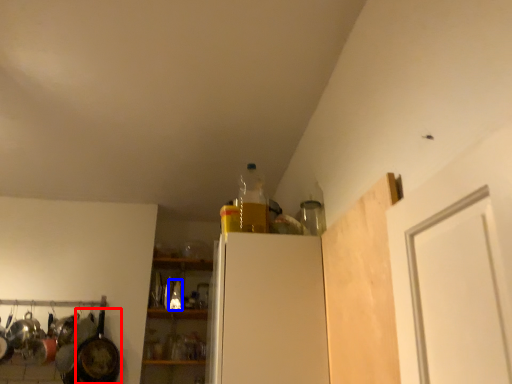
Question: Which object appears closest to the camera in this image, frying pan (highlighted by a red box) or bottle (highlighted by a blue box)?

Choices:
 (A) frying pan
 (B) bottle

Answer: (A)